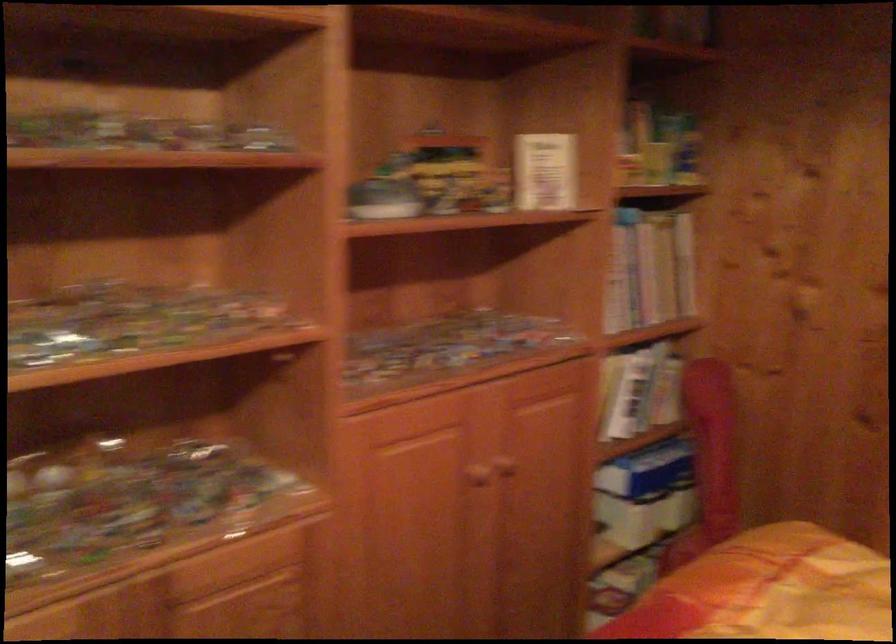
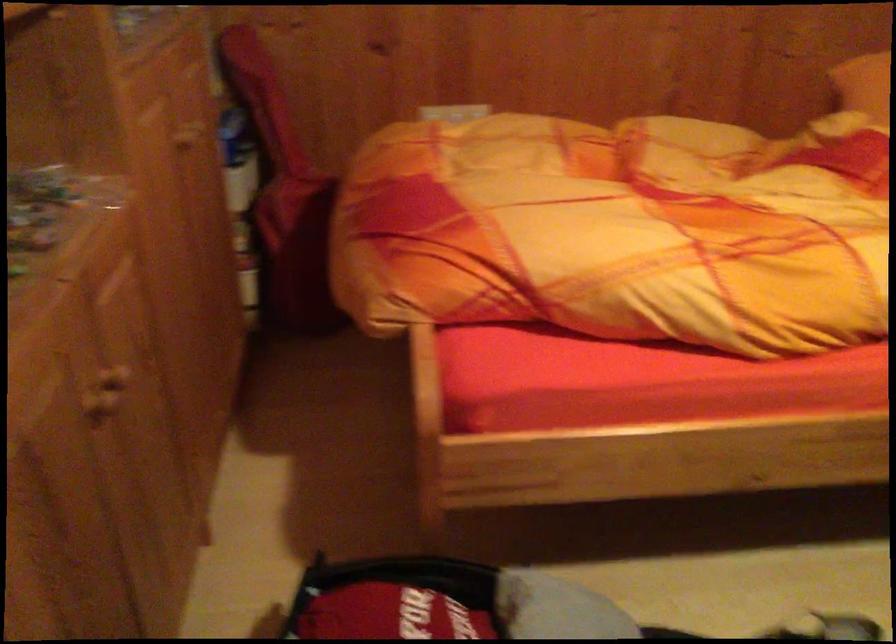
First-person continuous shooting, in which direction is the camera rotating?

The rotation direction of the camera is right-down.